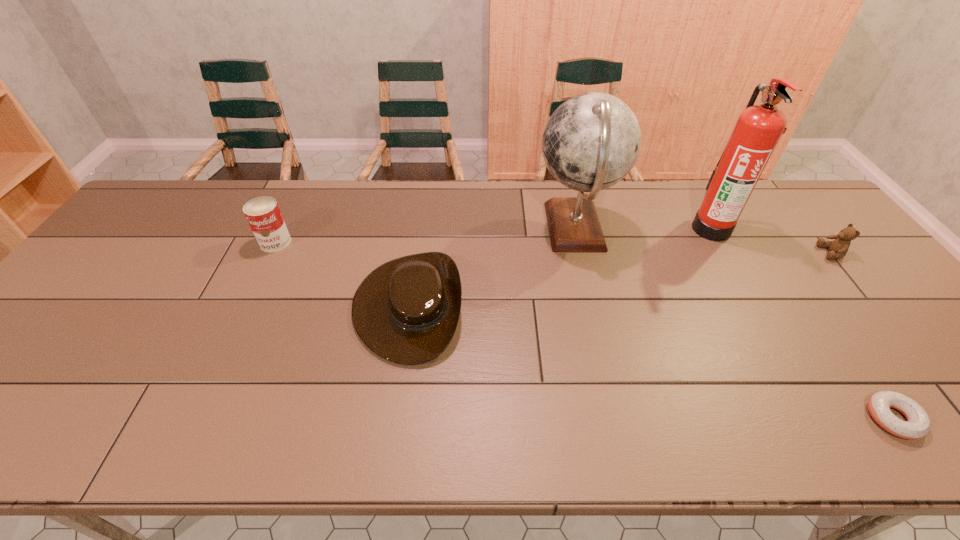
Where is `free location located with the nozzle pointing from the back of the fire extinguisher`? free location located with the nozzle pointing from the back of the fire extinguisher is located at coordinates (660, 228).

Identify the location of vacant space located 0.220m at the equator of the third object from left to right. (462, 228).

Locate an element on the screen. Image resolution: width=960 pixels, height=540 pixels. blank area located at the equator of the third object from left to right is located at coordinates (436, 228).

Locate an element on the screen. Image resolution: width=960 pixels, height=540 pixels. vacant space situated 0.360m at the equator of the third object from left to right is located at coordinates click(417, 228).

Locate an element on the screen. Image resolution: width=960 pixels, height=540 pixels. vacant space located on the front label of the third tallest object is located at coordinates coord(228,340).

Locate an element on the screen. free spot located 0.170m on the front-facing side of the teddy bear is located at coordinates (761, 253).

I want to click on vacant space located on the front-facing side of the teddy bear, so click(731, 253).

You are a GUI agent. You are given a task and a screenshot of the screen. Output one action in this format:
    pyautogui.click(x=<x>, y=<y>)
    Task: Click on the free point located 0.240m on the front-facing side of the teddy bear
    
    Given the screenshot: What is the action you would take?
    pyautogui.click(x=737, y=253)

Identify the location of vacant area situated on the back of the second object from left to right. Image resolution: width=960 pixels, height=540 pixels. (423, 202).

Image resolution: width=960 pixels, height=540 pixels. In order to click on vacant point located 0.210m on the back of the nearest object in this screenshot , I will do (x=825, y=320).